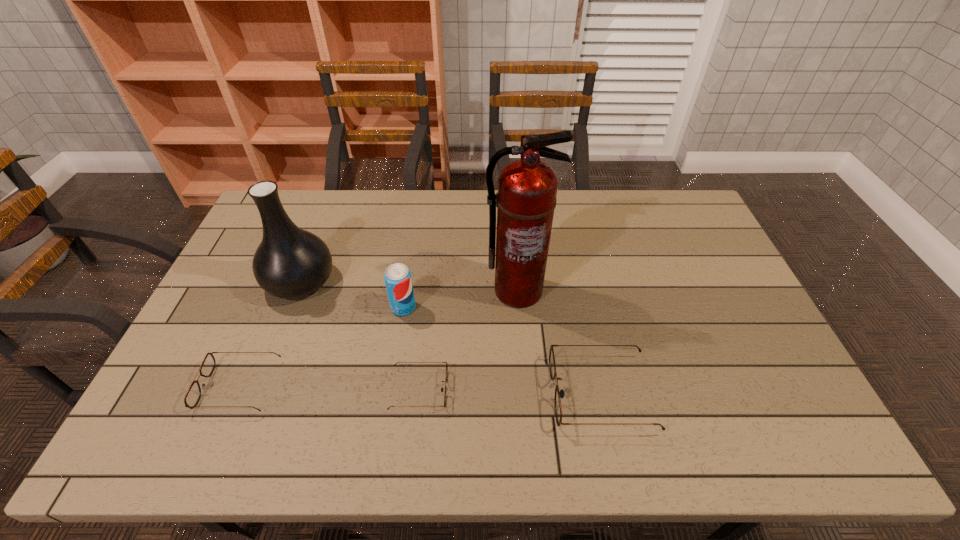
Where is `sunglasses that is the third nearest to the fourth shortest object`? The width and height of the screenshot is (960, 540). sunglasses that is the third nearest to the fourth shortest object is located at coordinates (552, 366).

The width and height of the screenshot is (960, 540). In order to click on free spot that satisfies the following two spatial constraints: 1. on the side of the fire extinguisher with the handle and hose; 2. on the front-facing side of the fifth tallest object in this screenshot , I will do `click(525, 386)`.